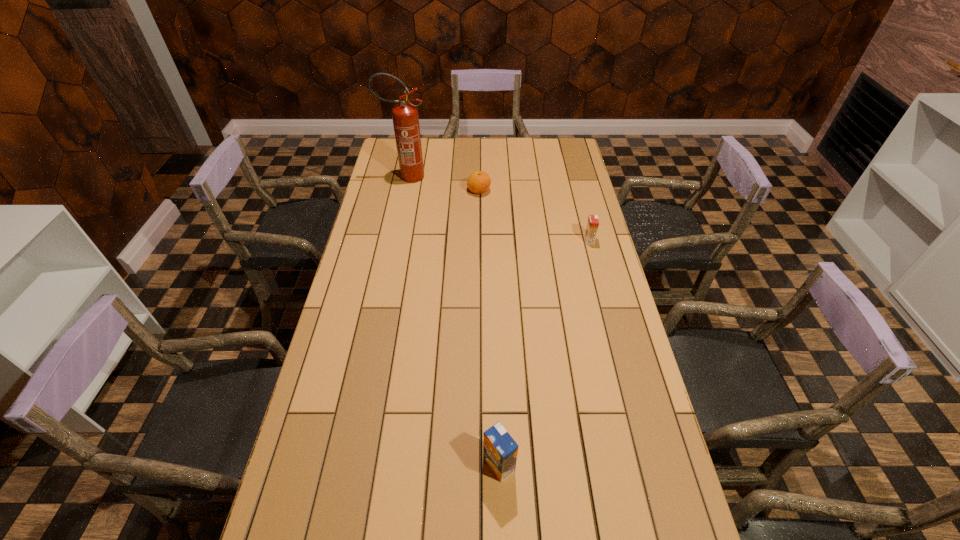
In order to click on the farthest object in this screenshot , I will do `click(405, 117)`.

Locate an element on the screen. the leftmost object is located at coordinates (405, 117).

The image size is (960, 540). I want to click on the nearer orange juice, so click(x=500, y=450).

Locate an element on the screen. The width and height of the screenshot is (960, 540). the nearest object is located at coordinates (500, 450).

Where is `the second nearest object`? The width and height of the screenshot is (960, 540). the second nearest object is located at coordinates (592, 225).

Locate an element on the screen. The width and height of the screenshot is (960, 540). the rightmost object is located at coordinates (592, 225).

The height and width of the screenshot is (540, 960). What are the coordinates of `the shortest object` in the screenshot? It's located at (478, 182).

Locate an element on the screen. This screenshot has height=540, width=960. clementine is located at coordinates (478, 182).

Identify the location of free point located from the nozzle of the leftmost object. The height and width of the screenshot is (540, 960). (461, 177).

Locate an element on the screen. The image size is (960, 540). vacant space situated on the left of the left orange juice is located at coordinates (348, 465).